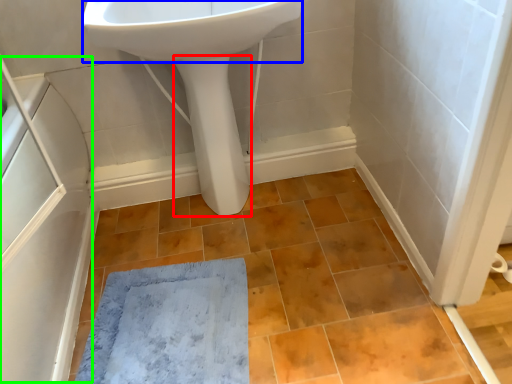
Question: Considering the real-world distances, which object is closest to bidet (highlighted by a red box)? sink (highlighted by a blue box) or screen door (highlighted by a green box).

Choices:
 (A) sink
 (B) screen door

Answer: (A)